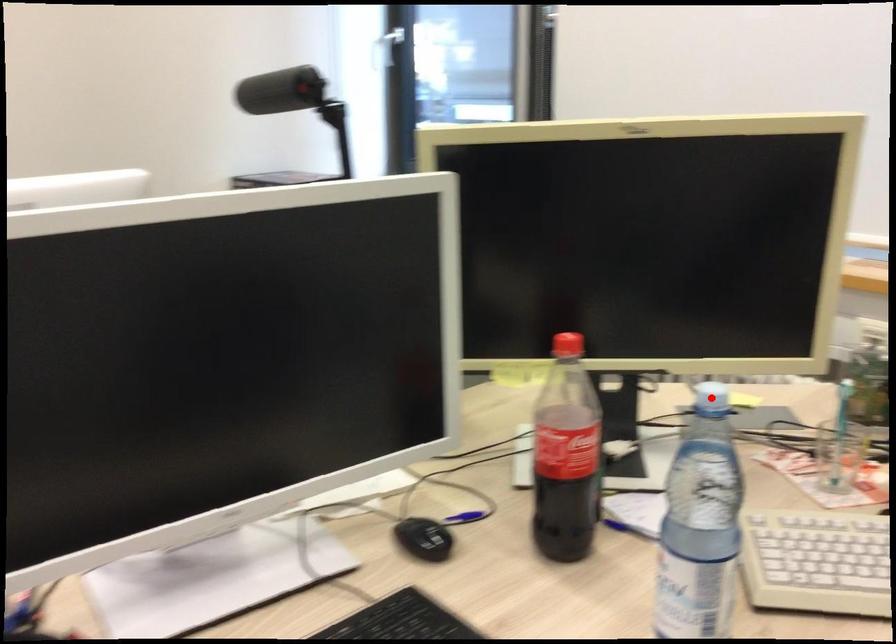
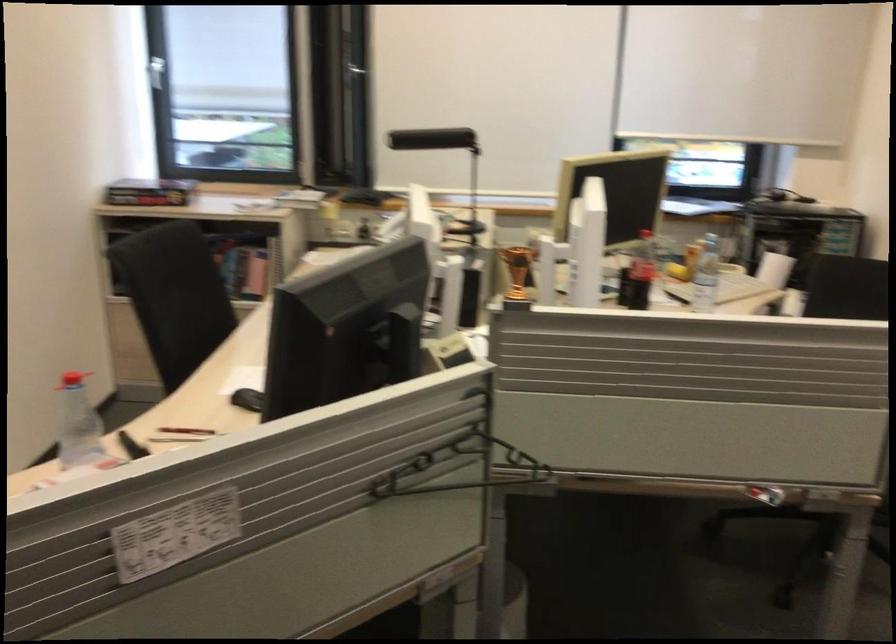
Question: I am providing you with two images of the same scene from different viewpoints. Given a red point in image1, look at the same physical point in image2. Is it:

Choices:
 (A) Closer to the viewpoint
 (B) Farther from the viewpoint

Answer: (B)